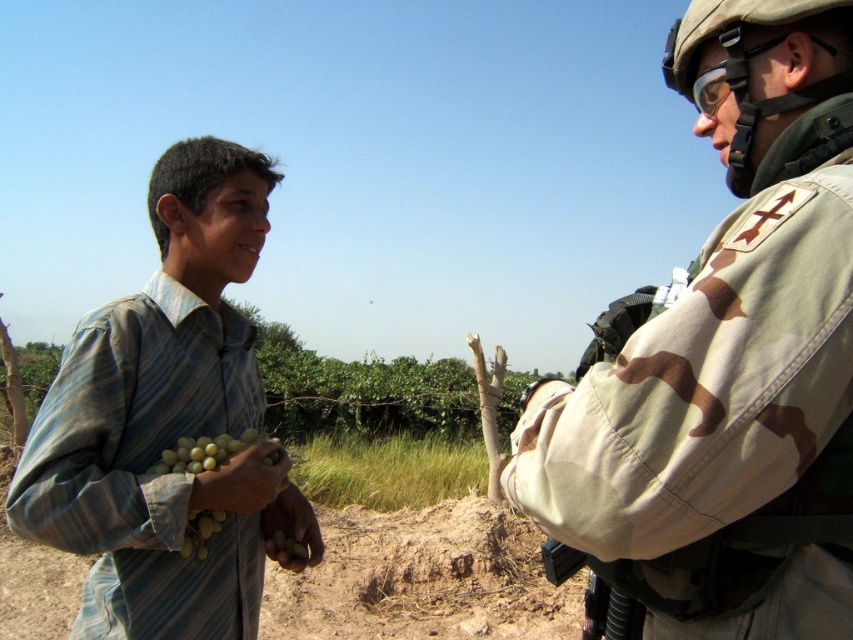
You are a photographer trying to capture a portrait of both the camouflage fabric uniform at right and the green matte grapes at lower left in the same frame. Based on their positions and sizes, will you need to adjust your camera angle to ensure both are fully visible?

The camouflage fabric uniform at right might be wider than green matte grapes at lower left, so adjusting the camera angle may be necessary to ensure both are fully visible in the frame.